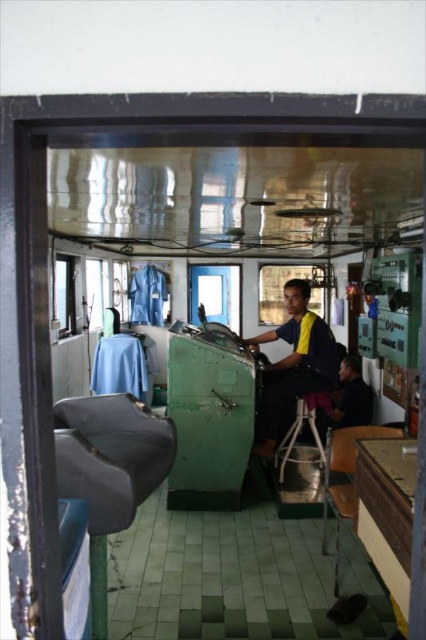
Question: Which point is farther from the camera taking this photo?

Choices:
 (A) (143, 422)
 (B) (359, 435)
 (C) (302, 412)
 (D) (282, 332)

Answer: (D)

Question: Which object appears farthest from the camera in this image?

Choices:
 (A) dark blue uniform at center
 (B) wooden chair at lower right

Answer: (A)

Question: Where is matte gray plastic chair at left located in relation to wooden chair at lower right in the image?

Choices:
 (A) below
 (B) above

Answer: (B)

Question: Does matte gray plastic chair at left appear under metallic silver stool at center?

Choices:
 (A) yes
 (B) no

Answer: (B)

Question: Can you confirm if dark blue uniform at center is thinner than metallic silver stool at center?

Choices:
 (A) yes
 (B) no

Answer: (B)

Question: Which object is farther from the camera taking this photo?

Choices:
 (A) dark blue uniform at center
 (B) metallic silver stool at center
 (C) wooden chair at lower right
 (D) matte gray plastic chair at left

Answer: (B)